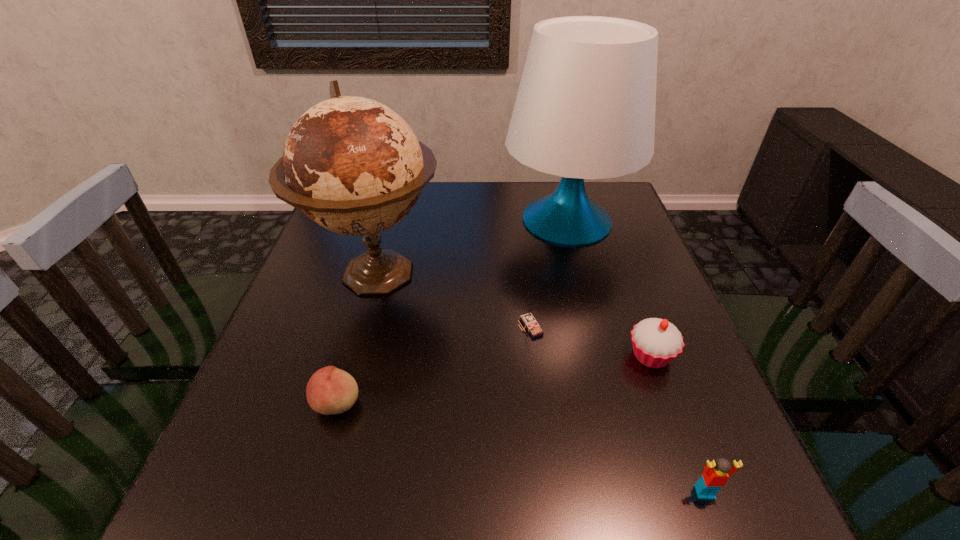
I want to click on cupcake at the right edge, so click(656, 342).

You are a GUI agent. You are given a task and a screenshot of the screen. Output one action in this format:
    pyautogui.click(x=<x>, y=<y>)
    Task: Click on the Lego situated at the right edge
    This screenshot has height=540, width=960.
    Given the screenshot: What is the action you would take?
    pyautogui.click(x=716, y=473)

Find the location of a particular element. This screenshot has height=540, width=960. object that is at the far right corner is located at coordinates (585, 109).

Identify the location of object at the near right corner. Image resolution: width=960 pixels, height=540 pixels. (716, 473).

You are a GUI agent. You are given a task and a screenshot of the screen. Output one action in this format:
    pyautogui.click(x=<x>, y=<y>)
    Task: Click on the vacant space at the far edge of the desktop
    
    Given the screenshot: What is the action you would take?
    pyautogui.click(x=444, y=215)

Locate an element on the screen. free region at the near edge of the desktop is located at coordinates (635, 517).

The height and width of the screenshot is (540, 960). What are the coordinates of `free spot at the left edge of the desktop` in the screenshot? It's located at (252, 433).

Find the location of a particular element. The width and height of the screenshot is (960, 540). free space at the right edge is located at coordinates (656, 301).

Locate an element on the screen. vacant space at the near left corner of the desktop is located at coordinates (265, 508).

You are a GUI agent. You are given a task and a screenshot of the screen. Output one action in this format:
    pyautogui.click(x=<x>, y=<y>)
    Task: Click on the free space at the far right corner of the desktop
    The height and width of the screenshot is (540, 960).
    Given the screenshot: What is the action you would take?
    pyautogui.click(x=603, y=206)